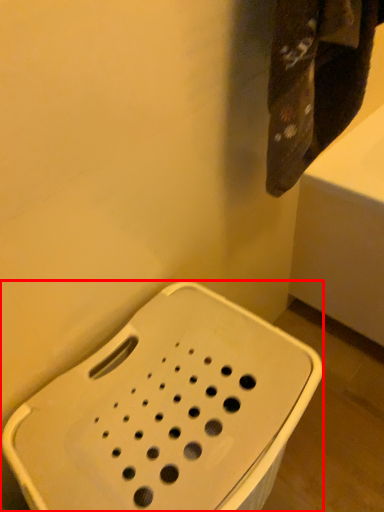
Question: In this image, where is porcelain (annotated by the red box) located relative to towel?

Choices:
 (A) left
 (B) right

Answer: (A)